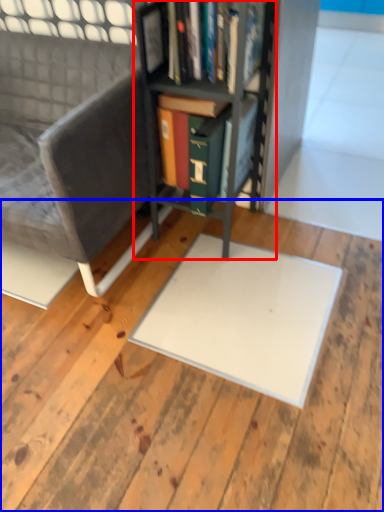
Question: Among these objects, which one is nearest to the camera, bookcase (highlighted by a red box) or plywood (highlighted by a blue box)?

Choices:
 (A) bookcase
 (B) plywood

Answer: (B)